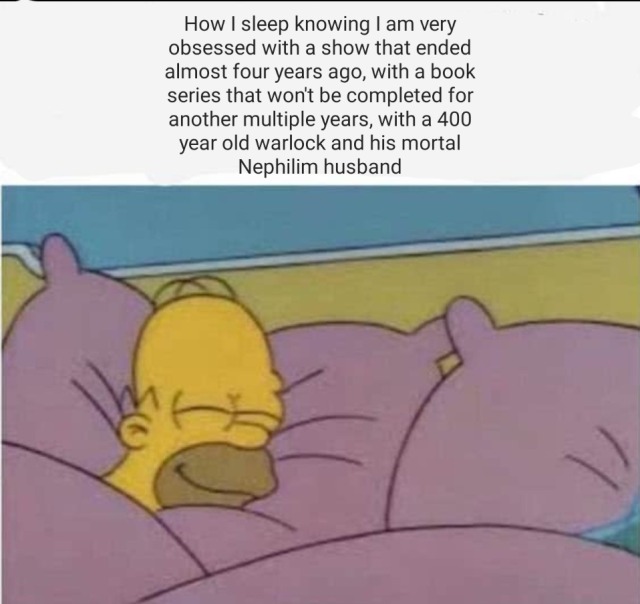
At what (x,y) coordinates should I click in order to perform the action: click on purple blanket. Please return your answer as a coordinate pair (x, y). Looking at the image, I should click on (129, 562).